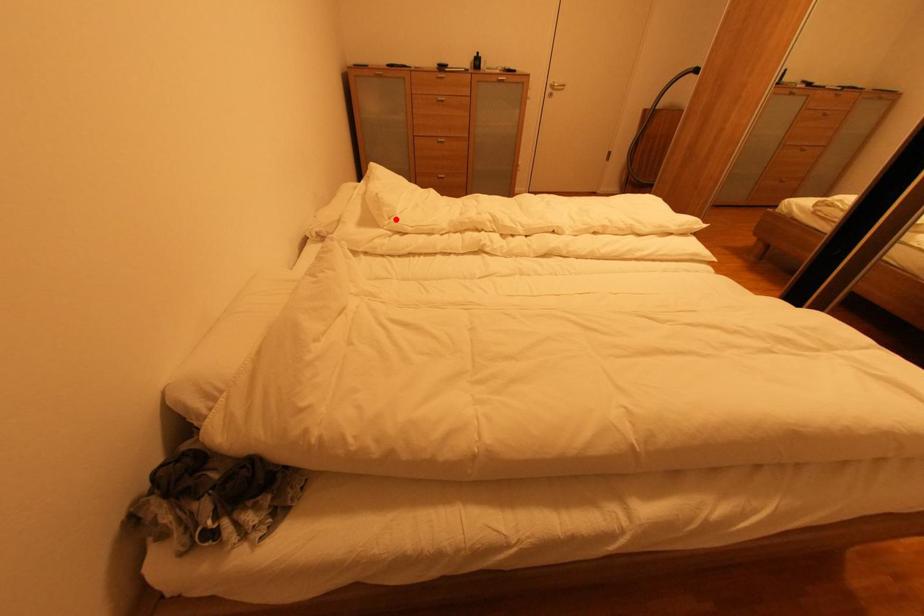
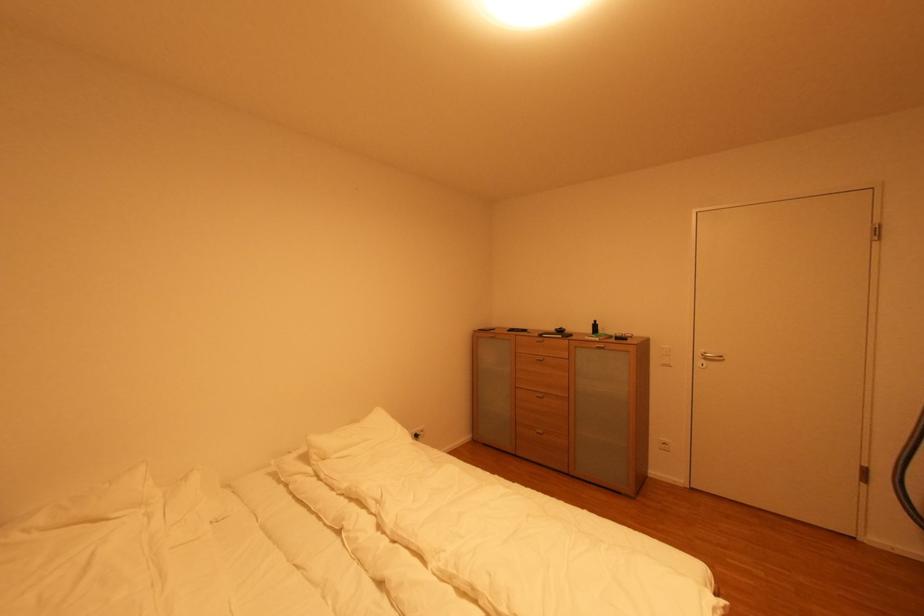
Where in the second image is the point corresponding to the highlighted location from the first image?

(330, 461)